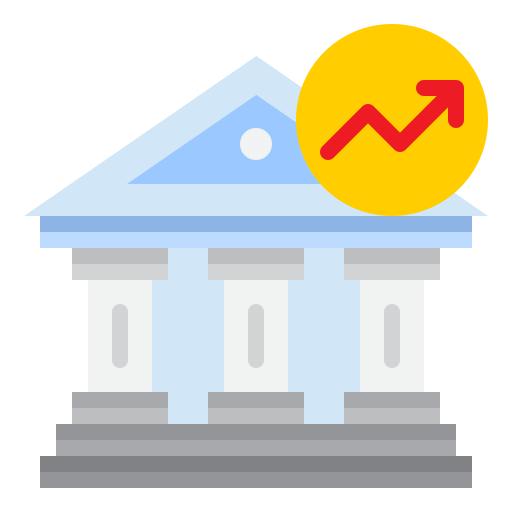
Image resolution: width=512 pixels, height=512 pixels. In order to click on stairs in this screenshot , I will do coord(277,432).